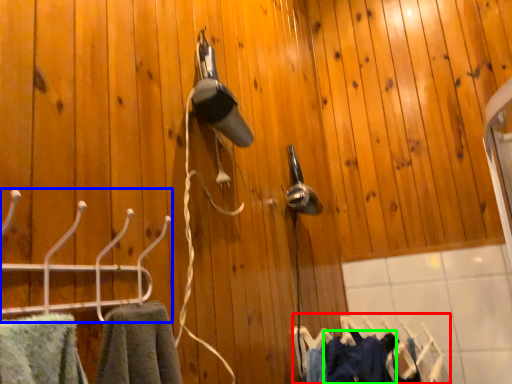
Question: Which object is the farthest from laundry (highlighted by a red box)? Choose among these: hanger (highlighted by a blue box) or clothing (highlighted by a green box).

Choices:
 (A) hanger
 (B) clothing

Answer: (A)